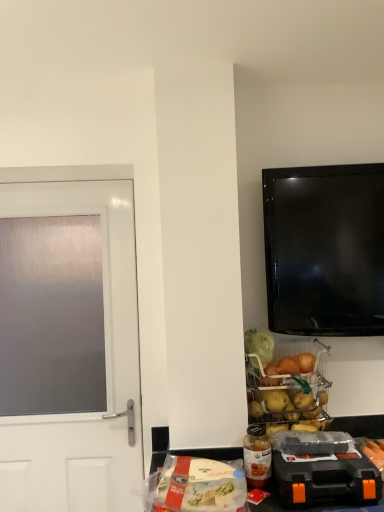
The height and width of the screenshot is (512, 384). What do you see at coordinates (199, 486) in the screenshot?
I see `translucent plastic bag of pasta at lower center` at bounding box center [199, 486].

The height and width of the screenshot is (512, 384). In order to click on translucent plastic bag of pasta at lower center in this screenshot , I will do `click(199, 486)`.

Locate an element on the screen. translucent plastic bag of pasta at lower center is located at coordinates pos(199,486).

In the image, there is a orange plastic toolbox at lower right, the second appliance when ordered from top to bottom. Where is `food below it (from the image's perspective)`? food below it (from the image's perspective) is located at coordinates (199, 486).

Which is correct: translucent plastic bag of pasta at lower center is inside orange plastic toolbox at lower right, placed as the first appliance when sorted from bottom to top, or outside of it?

translucent plastic bag of pasta at lower center exists outside the volume of orange plastic toolbox at lower right, placed as the first appliance when sorted from bottom to top.

How many degrees apart are the facing directions of translucent plastic bag of pasta at lower center and orange plastic toolbox at lower right, the second appliance when ordered from top to bottom?

There is a 0.432-degree angle between the facing directions of translucent plastic bag of pasta at lower center and orange plastic toolbox at lower right, the second appliance when ordered from top to bottom.

From a real-world perspective, is translucent plastic bag of pasta at lower center below orange plastic toolbox at lower right, the 2th appliance viewed from the back?

Yes.

Is translucent plastic bottle at lower center placed right next to metallic wire basket at lower center, the 1th appliance from the top?

There is a gap between translucent plastic bottle at lower center and metallic wire basket at lower center, the 1th appliance from the top.

In the image, is translucent plastic bottle at lower center on the left side or the right side of metallic wire basket at lower center, the first appliance viewed from the back?

In the image, translucent plastic bottle at lower center appears on the left side of metallic wire basket at lower center, the first appliance viewed from the back.

Which is behind, point (261, 467) or point (295, 355)?

The point (295, 355) is farther.

Considering the relative positions of translucent plastic bottle at lower center and metallic wire basket at lower center, the 2th appliance when ordered from front to back, in the image provided, is translucent plastic bottle at lower center in front of metallic wire basket at lower center, the 2th appliance when ordered from front to back,?

That is True.

Does point (282, 355) lie behind point (32, 187)?

No, (282, 355) is closer to viewer.

In order to click on door on the left side of metallic wire basket at lower center, the 1th appliance from the top in this screenshot , I will do `click(105, 358)`.

Measure the distance from metallic wire basket at lower center, the 2th appliance when ordered from front to back, to satin white door at left.

They are 27.71 inches apart.

From the image's perspective, is metallic wire basket at lower center, the 1th appliance from the top, on satin white door at left?

Indeed, from the image's perspective, metallic wire basket at lower center, the 1th appliance from the top, is shown above satin white door at left.

Is metallic wire basket at lower center, which appears as the second appliance when ordered from the bottom, not within translucent plastic bag of pasta at lower center?

metallic wire basket at lower center, which appears as the second appliance when ordered from the bottom, lies outside translucent plastic bag of pasta at lower center's area.

Is metallic wire basket at lower center, which appears as the second appliance when ordered from the bottom, further to camera compared to translucent plastic bag of pasta at lower center?

That is True.

Does metallic wire basket at lower center, which appears as the second appliance when ordered from the bottom, have a greater height compared to translucent plastic bag of pasta at lower center?

Correct, metallic wire basket at lower center, which appears as the second appliance when ordered from the bottom, is much taller as translucent plastic bag of pasta at lower center.

Can you tell me how much metallic wire basket at lower center, the 1th appliance from the top, and translucent plastic bag of pasta at lower center differ in facing direction?

They differ by 4.21 degrees in their facing directions.

What's the angular difference between orange plastic toolbox at lower right, the 2th appliance viewed from the back, and translucent plastic bottle at lower center's facing directions?

0.432 degrees.

Which is less distant, (279, 445) or (262, 484)?

Point (262, 484)

Which object is positioned more to the right, orange plastic toolbox at lower right, the 2th appliance viewed from the back, or translucent plastic bottle at lower center?

orange plastic toolbox at lower right, the 2th appliance viewed from the back, is more to the right.

Considering the relative sizes of orange plastic toolbox at lower right, which appears as the first appliance when viewed from the front, and translucent plastic bottle at lower center in the image provided, is orange plastic toolbox at lower right, which appears as the first appliance when viewed from the front, wider than translucent plastic bottle at lower center?

Indeed, orange plastic toolbox at lower right, which appears as the first appliance when viewed from the front, has a greater width compared to translucent plastic bottle at lower center.

Which is correct: translucent plastic bottle at lower center is inside translucent plastic bag of pasta at lower center, or outside of it?

translucent plastic bottle at lower center is not inside translucent plastic bag of pasta at lower center, it's outside.

Which is more to the right, translucent plastic bottle at lower center or translucent plastic bag of pasta at lower center?

translucent plastic bottle at lower center is more to the right.

Considering the sizes of translucent plastic bottle at lower center and translucent plastic bag of pasta at lower center in the image, is translucent plastic bottle at lower center taller or shorter than translucent plastic bag of pasta at lower center?

Clearly, translucent plastic bottle at lower center is taller compared to translucent plastic bag of pasta at lower center.

From the picture: Would you say translucent plastic bottle at lower center is a long distance from translucent plastic bag of pasta at lower center?

No, translucent plastic bottle at lower center is not far away from translucent plastic bag of pasta at lower center.

From the image's perspective, is translucent plastic bag of pasta at lower center beneath metallic wire basket at lower center, which appears as the second appliance when ordered from the bottom?

Correct, translucent plastic bag of pasta at lower center appears lower than metallic wire basket at lower center, which appears as the second appliance when ordered from the bottom, in the image.

Considering the relative positions of translucent plastic bag of pasta at lower center and metallic wire basket at lower center, which appears as the second appliance when ordered from the bottom, in the image provided, is translucent plastic bag of pasta at lower center in front of metallic wire basket at lower center, which appears as the second appliance when ordered from the bottom,?

Yes, the depth of translucent plastic bag of pasta at lower center is less than that of metallic wire basket at lower center, which appears as the second appliance when ordered from the bottom.

Which point is more distant from viewer, (229, 478) or (287, 396)?

Point (287, 396)

The image size is (384, 512). I want to click on the 2nd appliance behind the translucent plastic bag of pasta at lower center, so click(285, 379).

From the image's perspective, count 1st appliances upward from the translucent plastic bag of pasta at lower center and point to it. Please provide its 2D coordinates.

[(322, 469)]

Find the location of `bottle that is under the metallic wire basket at lower center, the first appliance viewed from the back (from a real-world perspective)`. bottle that is under the metallic wire basket at lower center, the first appliance viewed from the back (from a real-world perspective) is located at coordinates (257, 456).

Based on their spatial positions, is satin white door at left or metallic wire basket at lower center, the 1th appliance from the top, further from orange plastic toolbox at lower right, the 2th appliance viewed from the back?

Based on the image, satin white door at left appears to be further to orange plastic toolbox at lower right, the 2th appliance viewed from the back.

Estimate the real-world distances between objects in this image. Which object is closer to orange plastic toolbox at lower right, placed as the first appliance when sorted from bottom to top, translucent plastic bag of pasta at lower center or satin white door at left?

The object closer to orange plastic toolbox at lower right, placed as the first appliance when sorted from bottom to top, is translucent plastic bag of pasta at lower center.

From the image, which object appears to be nearer to translucent plastic bottle at lower center, translucent plastic bag of pasta at lower center or orange plastic toolbox at lower right, the second appliance when ordered from top to bottom?

The object closer to translucent plastic bottle at lower center is orange plastic toolbox at lower right, the second appliance when ordered from top to bottom.

Based on their spatial positions, is translucent plastic bag of pasta at lower center or metallic wire basket at lower center, which appears as the second appliance when ordered from the bottom, further from satin white door at left?

translucent plastic bag of pasta at lower center lies further to satin white door at left than the other object.

Looking at the image, which one is located further to metallic wire basket at lower center, the 1th appliance from the top, translucent plastic bag of pasta at lower center or orange plastic toolbox at lower right, the 2th appliance viewed from the back?

translucent plastic bag of pasta at lower center.

When comparing their distances from orange plastic toolbox at lower right, which appears as the first appliance when viewed from the front, does satin white door at left or translucent plastic bag of pasta at lower center seem closer?

translucent plastic bag of pasta at lower center is closer to orange plastic toolbox at lower right, which appears as the first appliance when viewed from the front.

Which object lies further to the anchor point translucent plastic bottle at lower center, translucent plastic bag of pasta at lower center or metallic wire basket at lower center, the 2th appliance when ordered from front to back?

metallic wire basket at lower center, the 2th appliance when ordered from front to back.

Which object lies nearer to the anchor point translucent plastic bottle at lower center, metallic wire basket at lower center, which appears as the second appliance when ordered from the bottom, or orange plastic toolbox at lower right, the 2th appliance viewed from the back?

orange plastic toolbox at lower right, the 2th appliance viewed from the back, is closer to translucent plastic bottle at lower center.

I want to click on food between satin white door at left and metallic wire basket at lower center, the 2th appliance when ordered from front to back, in the horizontal direction, so click(x=199, y=486).

I want to click on appliance between satin white door at left and orange plastic toolbox at lower right, the 2th appliance viewed from the back, so click(285, 379).

At what (x,y) coordinates should I click in order to perform the action: click on bottle between metallic wire basket at lower center, the 2th appliance when ordered from front to back, and orange plastic toolbox at lower right, the second appliance when ordered from top to bottom, in the up-down direction. Please return your answer as a coordinate pair (x, y). The width and height of the screenshot is (384, 512). Looking at the image, I should click on (257, 456).

Locate an element on the screen. bottle between satin white door at left and metallic wire basket at lower center, the 1th appliance from the top is located at coordinates (257, 456).